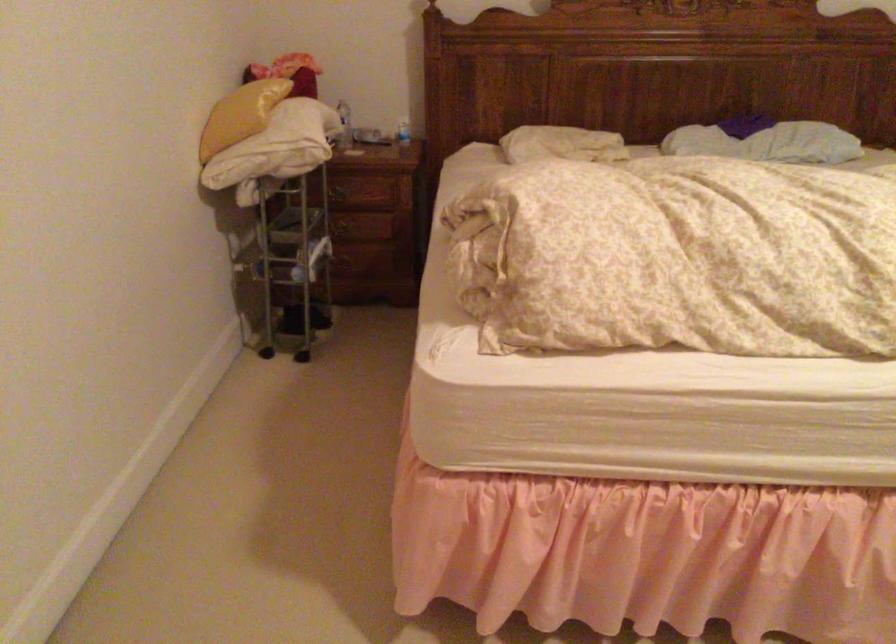
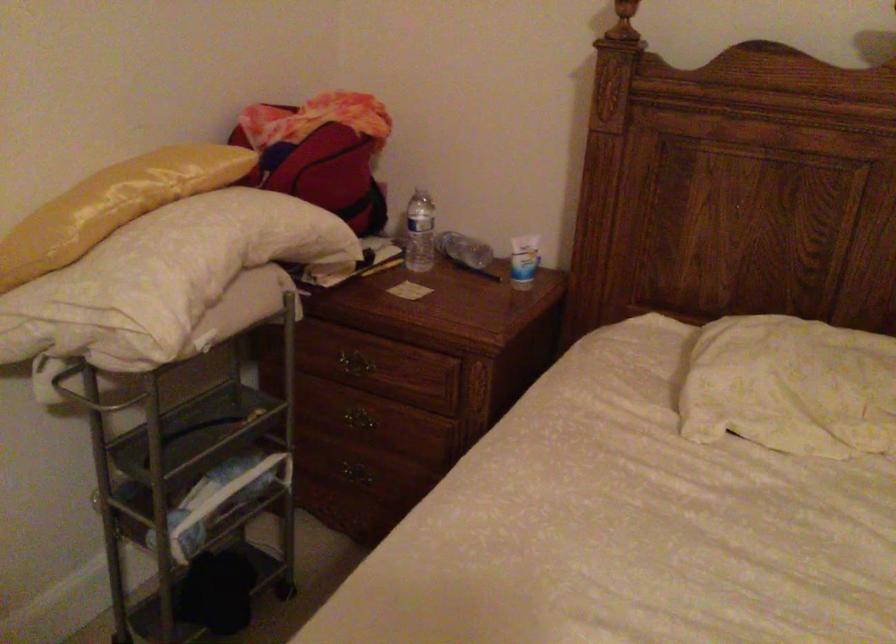
Question: What movement of the cameraman would produce the second image?

Choices:
 (A) Left
 (B) Right
 (C) Forward
 (D) Backward

Answer: (C)